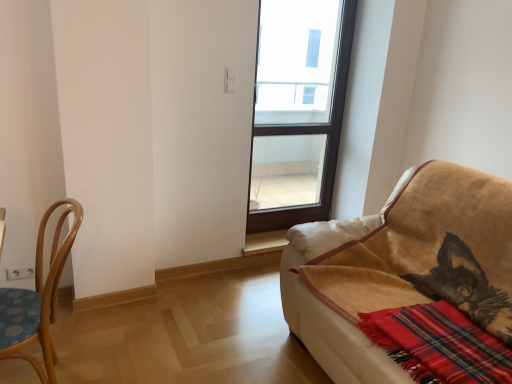
Question: Is red plaid blanket at lower right situated inside transparent glass window at center or outside?

Choices:
 (A) outside
 (B) inside

Answer: (A)

Question: Is red plaid blanket at lower right wider or thinner than transparent glass window at center?

Choices:
 (A) wide
 (B) thin

Answer: (A)

Question: Which object is the closest to the velvet beige couch at right?

Choices:
 (A) red plaid blanket at lower right
 (B) transparent glass window at center
 (C) light brown wood chair at left

Answer: (A)

Question: Estimate the real-world distances between objects in this image. Which object is closer to the light brown wood chair at left?

Choices:
 (A) transparent glass window at center
 (B) red plaid blanket at lower right
 (C) velvet beige couch at right

Answer: (C)